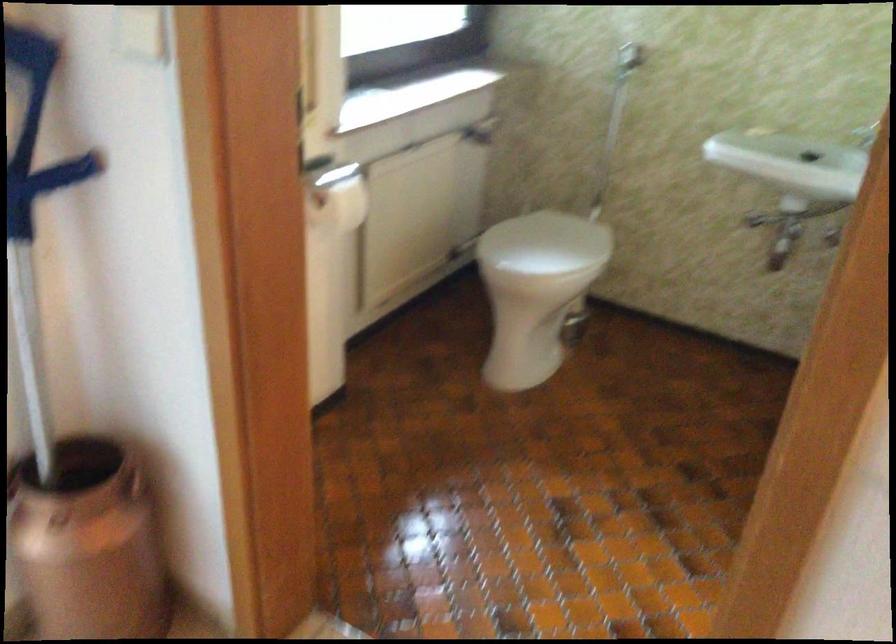
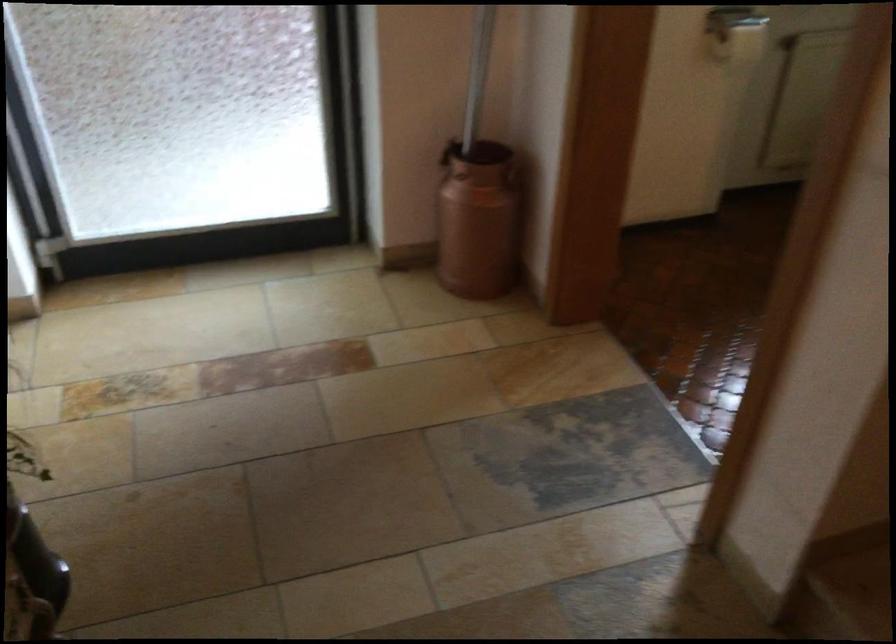
Where in the second image is the point corresponding to (x=122, y=567) from the first image?

(478, 220)